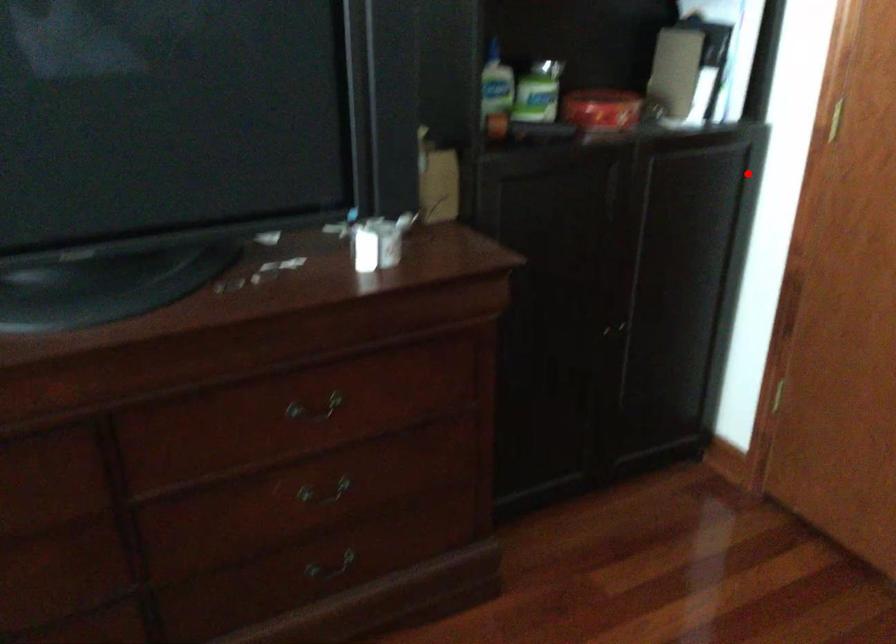
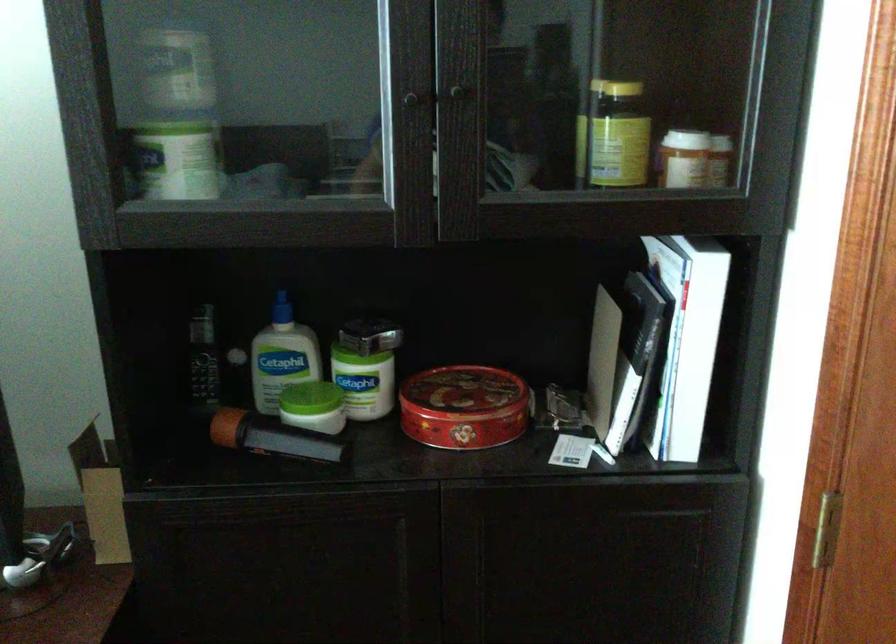
Question: I am providing you with two images of the same scene from different viewpoints. Image1 has a red point marked. In image2, the corresponding 3D location appears at what relative position? Reply with the corresponding letter.

Choices:
 (A) Closer
 (B) Farther

Answer: (A)